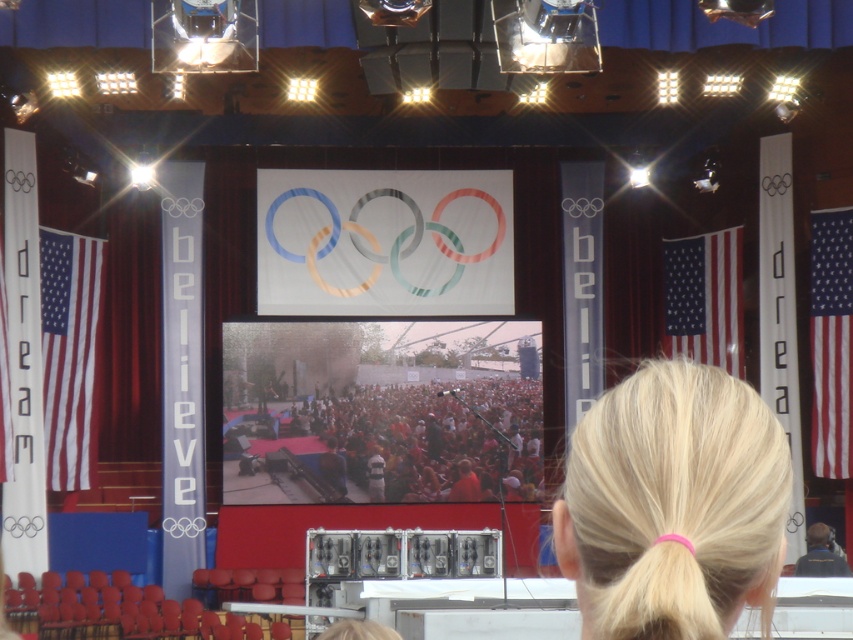
Question: Can you confirm if american flag at left is bigger than red fabric flag at right?

Choices:
 (A) no
 (B) yes

Answer: (B)

Question: Estimate the real-world distances between objects in this image. Which object is closer to the red fabric flag at right?

Choices:
 (A) dark blue fabric at center
 (B) red fabric crowd at center
 (C) matte fabric flag at right
 (D) american flag at left

Answer: (C)

Question: Based on their relative distances, which object is farther from the red fabric flag at right?

Choices:
 (A) blonde hair at upper center
 (B) pink rubber band at upper center
 (C) red fabric crowd at center

Answer: (B)

Question: Does pink rubber band at upper center have a larger size compared to red fabric flag at right?

Choices:
 (A) yes
 (B) no

Answer: (B)

Question: Which point is closer to the camera?

Choices:
 (A) american flag at left
 (B) red fabric flag at right
 (C) dark blue fabric at center

Answer: (C)

Question: Does blonde hair at upper center come in front of matte fabric flag at right?

Choices:
 (A) no
 (B) yes

Answer: (B)